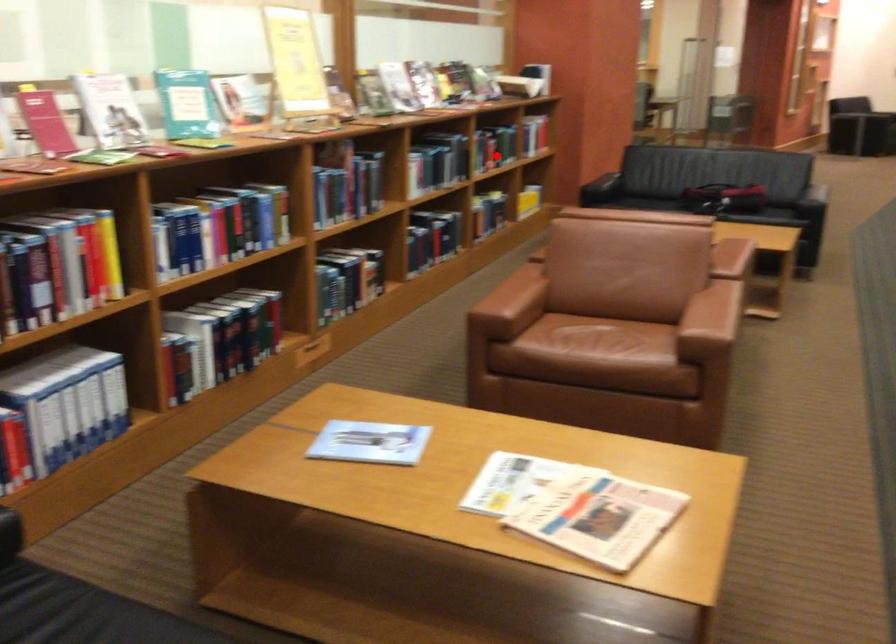
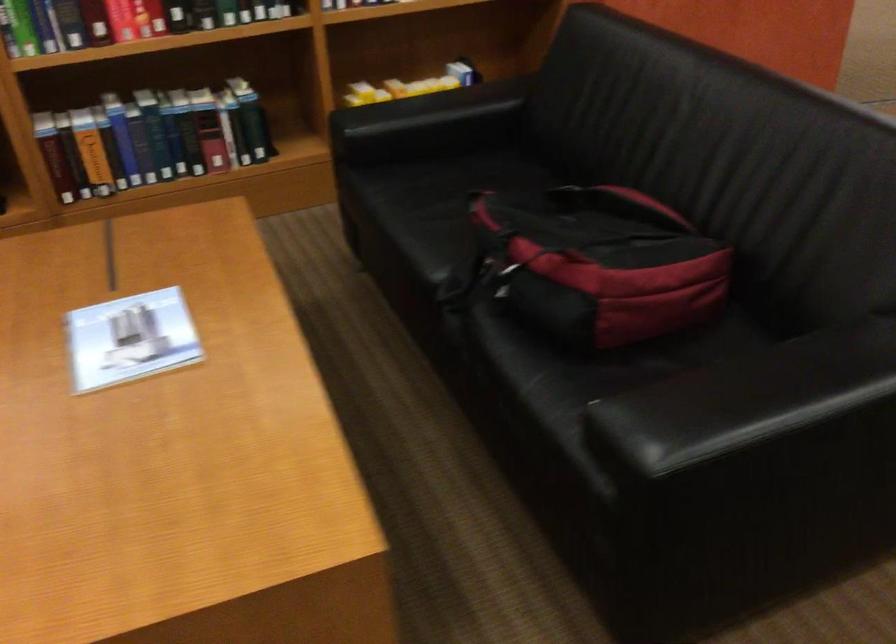
Question: I am providing you with two images of the same scene from different viewpoints. Given a red point in image1, look at the same physical point in image2. Is it:

Choices:
 (A) Closer to the viewpoint
 (B) Farther from the viewpoint

Answer: (A)